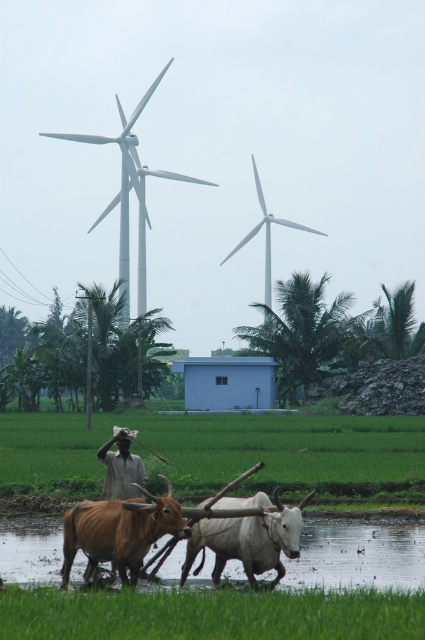
Question: Does brown glossy bull at lower left have a smaller size compared to white matte windmill at center?

Choices:
 (A) yes
 (B) no

Answer: (A)

Question: Which of the following is the closest to the observer?

Choices:
 (A) (399, 612)
 (B) (65, 525)

Answer: (A)

Question: Which point is farther to the camera?

Choices:
 (A) (121, 289)
 (B) (90, 518)

Answer: (A)

Question: Does green grass at lower center come behind brown glossy bull at lower left?

Choices:
 (A) no
 (B) yes

Answer: (A)

Question: Which object is positioned closest to the white glossy bull at center?

Choices:
 (A) brown muddy water at lower center
 (B) white matte windmill at upper center
 (C) green grass at lower center

Answer: (C)

Question: Is green grass at lower center above brown muddy water at lower center?

Choices:
 (A) no
 (B) yes

Answer: (B)